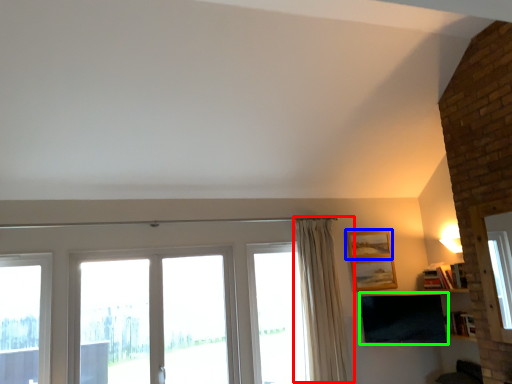
Question: Which is nearer to the curtain (highlighted by a red box)? picture frame (highlighted by a blue box) or television (highlighted by a green box).

Choices:
 (A) picture frame
 (B) television

Answer: (B)